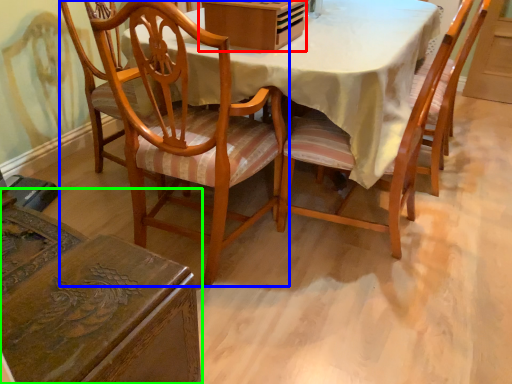
Question: Estimate the real-world distances between objects in this image. Which object is farther from box (highlighted by a red box), chair (highlighted by a blue box) or chair (highlighted by a green box)?

Choices:
 (A) chair
 (B) chair

Answer: (B)